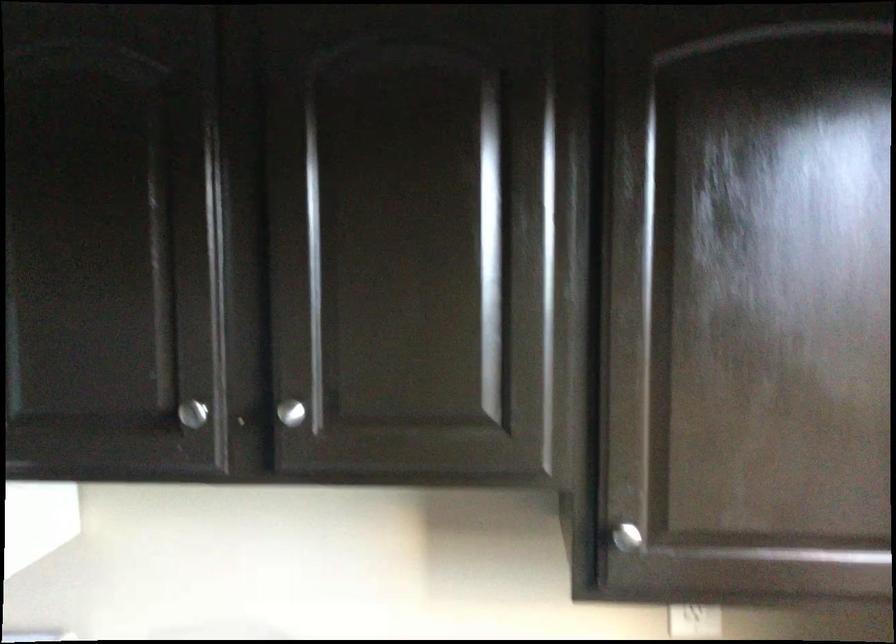
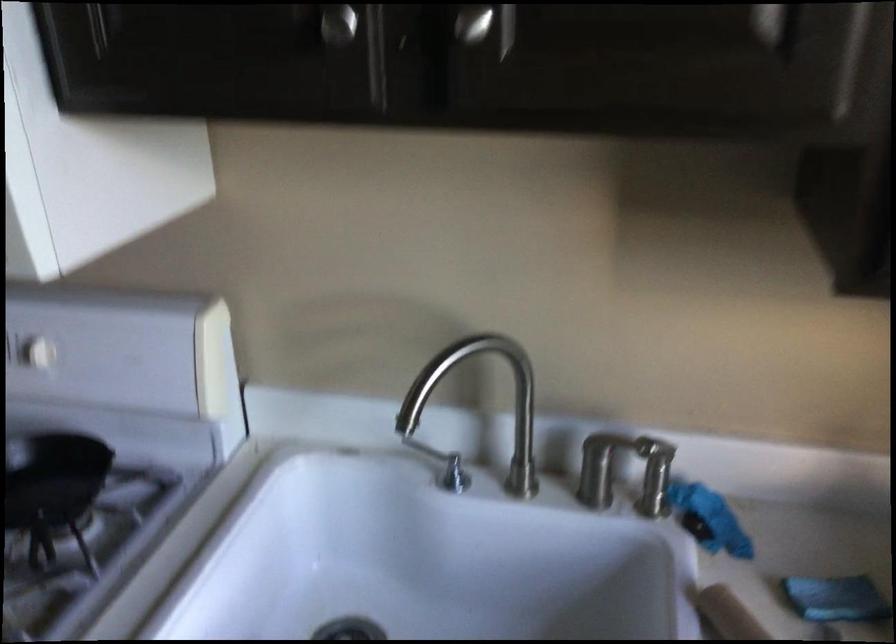
Question: I am providing you with two images of the same scene from different viewpoints. Which of the following objects are not visible in image2?

Choices:
 (A) white stove knob
 (B) silver cabinet knob
 (C) silver faucet handle
 (D) none of these

Answer: (D)